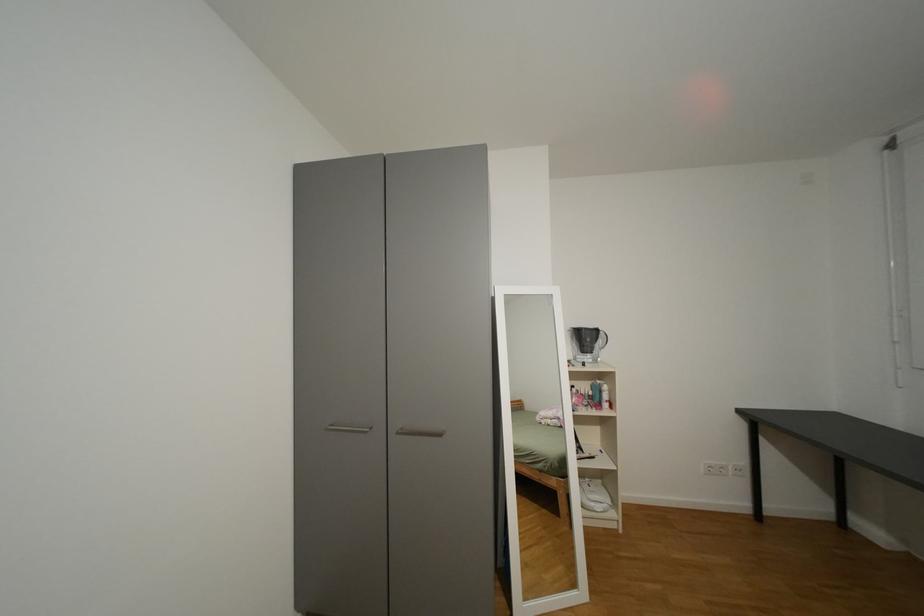
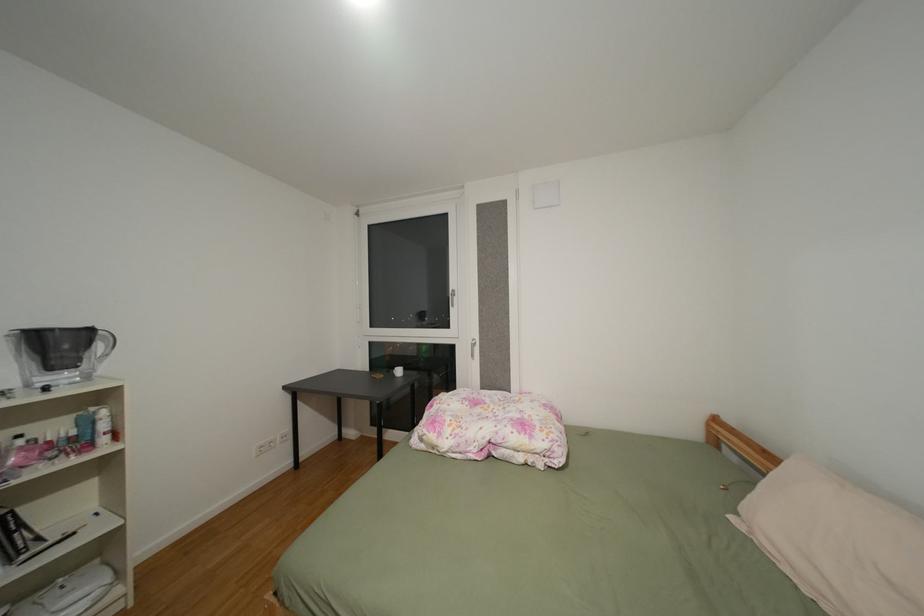
Question: How did the camera likely rotate?

Choices:
 (A) Left
 (B) Right
 (C) Up
 (D) Down

Answer: (B)